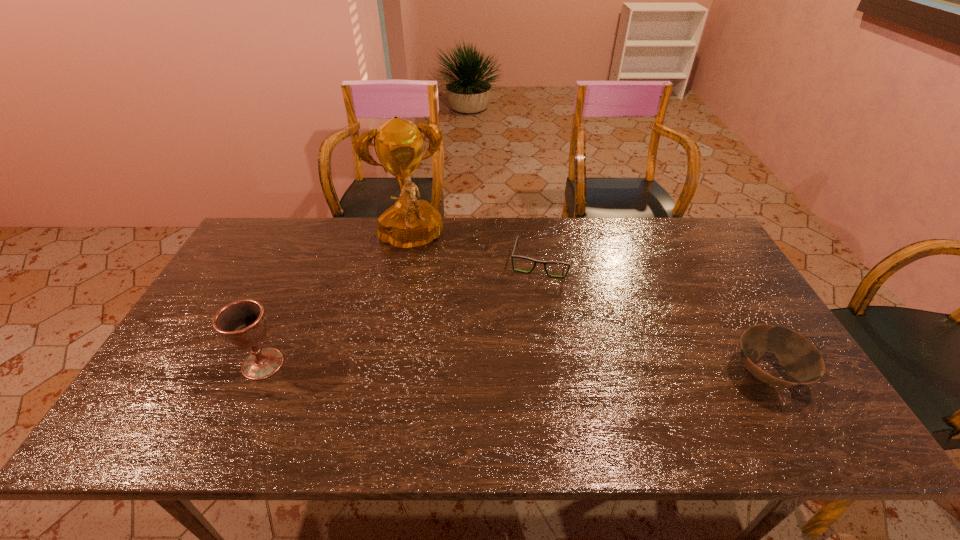
Locate an element on the screen. This screenshot has height=540, width=960. free space on the desktop that is between the third shortest object and the bowl and is positioned on the front side of the tallest object is located at coordinates (447, 368).

At what (x,y) coordinates should I click in order to perform the action: click on free spot on the desktop that is between the second tallest object and the rightmost object and is positioned on the lens of the third object from left to right. Please return your answer as a coordinate pair (x, y). The height and width of the screenshot is (540, 960). Looking at the image, I should click on (520, 369).